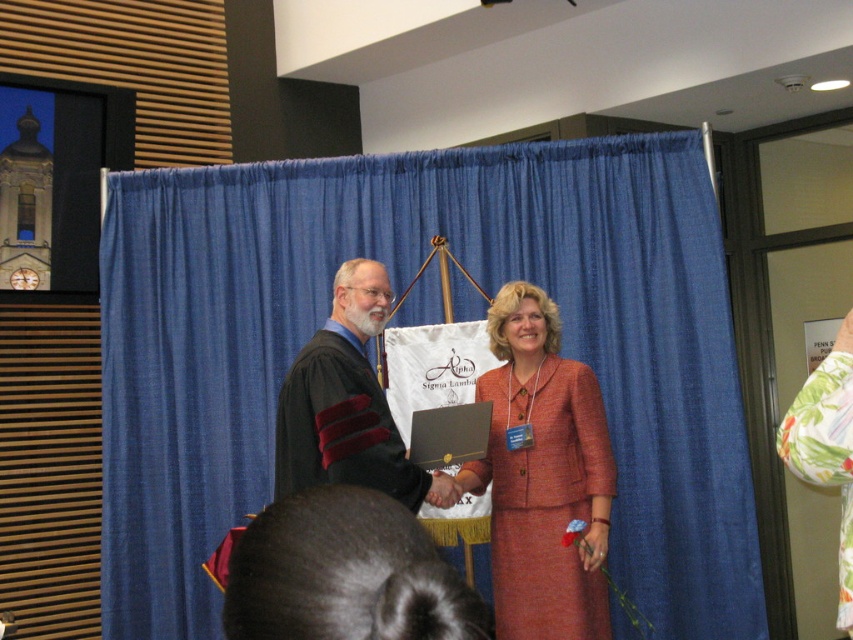
Question: Can you confirm if orange woolen suit at center is wider than matte black robe at center?

Choices:
 (A) no
 (B) yes

Answer: (B)

Question: Which of these objects is positioned closest to the orange woolen suit at center?

Choices:
 (A) blue fabric curtain at center
 (B) matte black robe at center

Answer: (B)

Question: Can you confirm if blue fabric curtain at center is positioned below orange woolen suit at center?

Choices:
 (A) no
 (B) yes

Answer: (A)

Question: Which object is closer to the camera taking this photo?

Choices:
 (A) blue fabric curtain at center
 (B) matte black robe at center
 (C) orange woolen suit at center

Answer: (B)

Question: Is blue fabric curtain at center bigger than matte black robe at center?

Choices:
 (A) no
 (B) yes

Answer: (B)

Question: Which object is farther from the camera taking this photo?

Choices:
 (A) matte black robe at center
 (B) orange woolen suit at center
 (C) blue fabric curtain at center

Answer: (C)